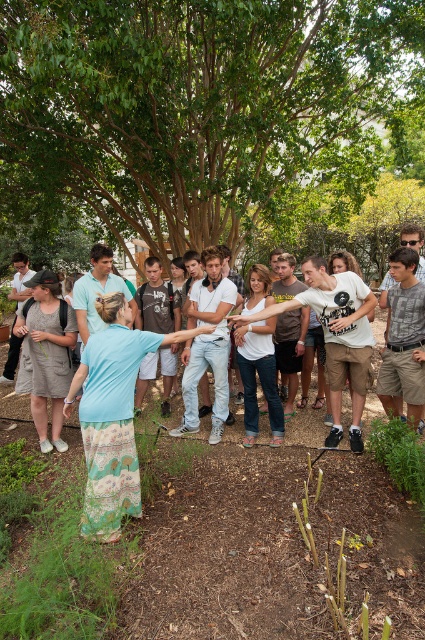
Which is behind, point (139, 61) or point (96, 374)?

Point (139, 61)

Is point (17, 61) farther from viewer compared to point (122, 490)?

Yes, point (17, 61) is behind point (122, 490).

Does point (280, 205) come farther from viewer compared to point (119, 460)?

Yes, it is.

You are a GUI agent. You are given a task and a screenshot of the screen. Output one action in this format:
    pyautogui.click(x=<x>, y=<y>)
    Task: Click on the green leafy tree at center
    This screenshot has height=640, width=425.
    Given the screenshot: What is the action you would take?
    pyautogui.click(x=209, y=124)

Is green leafy tree at center closer to the viewer compared to white fabric shirt at center?

No, green leafy tree at center is behind white fabric shirt at center.

Which is above, green leafy tree at center or white fabric shirt at center?

green leafy tree at center is above.

Locate an element on the screen. green leafy tree at center is located at coordinates (209, 124).

Who is more distant from viewer, [125,452] or [336,296]?

The point [336,296] is behind.

Measure the distance between light blue fabric skirt at lower left and camera.

light blue fabric skirt at lower left is 3.31 meters away from camera.

Between point (118, 512) and point (340, 301), which one is positioned behind?

The point (340, 301) is more distant.

Where is `light blue fabric skirt at lower left`? light blue fabric skirt at lower left is located at coordinates (113, 416).